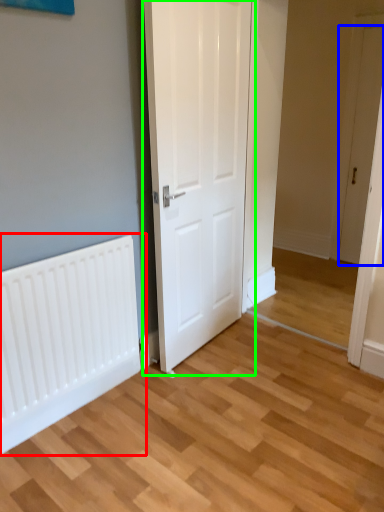
Question: Which is farther away from radiator (highlighted by a red box)? door (highlighted by a blue box) or door (highlighted by a green box)?

Choices:
 (A) door
 (B) door

Answer: (A)